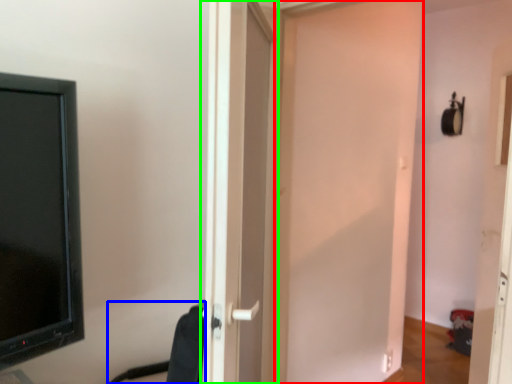
Question: Considering the real-world distances, which object is closest to door (highlighted by a red box)? swivel chair (highlighted by a blue box) or door (highlighted by a green box).

Choices:
 (A) swivel chair
 (B) door

Answer: (B)